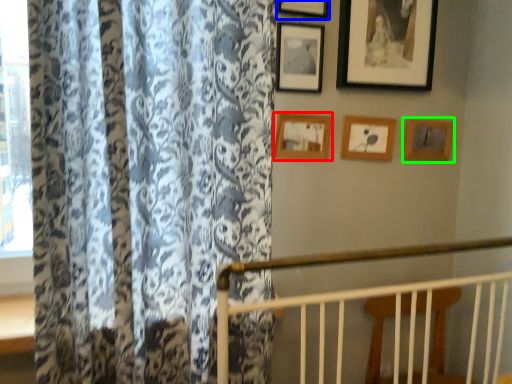
Question: Which is farther away from picture frame (highlighted by a red box)? picture frame (highlighted by a blue box) or picture frame (highlighted by a green box)?

Choices:
 (A) picture frame
 (B) picture frame

Answer: (B)